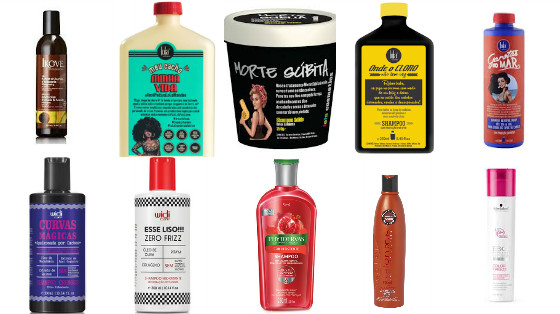
Where is `narrow bottles`? The width and height of the screenshot is (560, 314). narrow bottles is located at coordinates (507, 237), (380, 248), (506, 124), (54, 72).